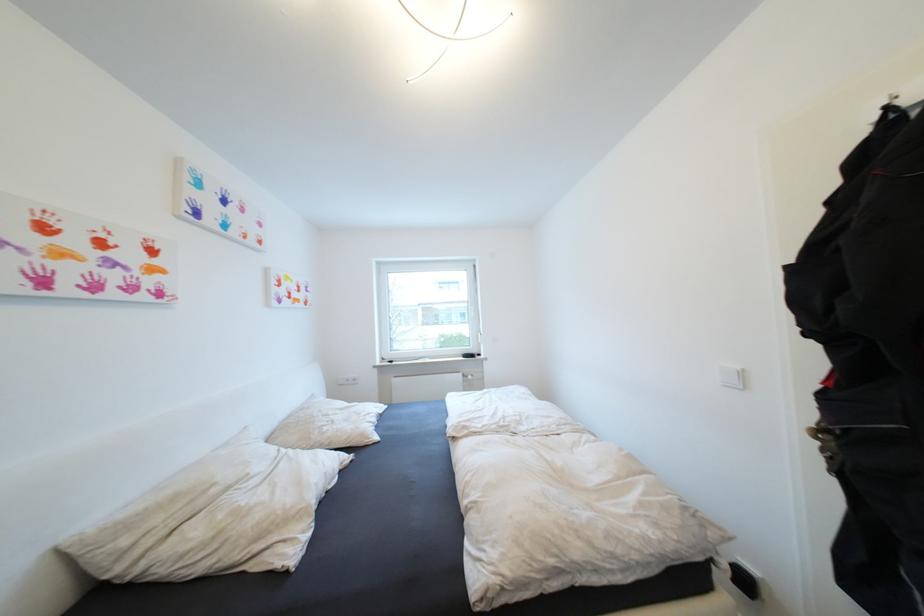
You are a GUI agent. You are given a task and a screenshot of the screen. Output one action in this format:
    pyautogui.click(x=<x>, y=<y>)
    Task: Click on the white light switch
    
    Given the screenshot: What is the action you would take?
    pos(732,377)